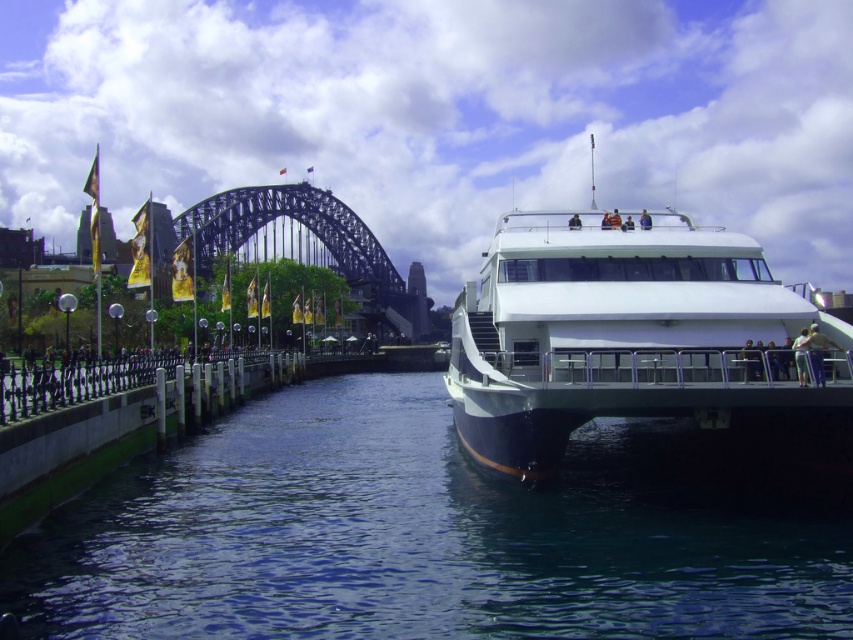
Can you confirm if blue water at center is shorter than white glossy cruise ship at center?

Indeed, blue water at center has a lesser height compared to white glossy cruise ship at center.

Is blue water at center to the left of white glossy cruise ship at center from the viewer's perspective?

Correct, you'll find blue water at center to the left of white glossy cruise ship at center.

Which is in front, point (270, 451) or point (558, 458)?

Point (558, 458) is more forward.

The image size is (853, 640). I want to click on blue water at center, so click(433, 532).

Between blue water at center and metallic steel bridge at upper center, which one has more height?

metallic steel bridge at upper center is taller.

Is blue water at center closer to the viewer compared to metallic steel bridge at upper center?

That is True.

Between point (786, 621) and point (415, 273), which one is positioned behind?

Point (415, 273)

This screenshot has width=853, height=640. Find the location of `blue water at center`. blue water at center is located at coordinates (433, 532).

Can you confirm if white glossy cruise ship at center is wider than metallic steel bridge at upper center?

Indeed, white glossy cruise ship at center has a greater width compared to metallic steel bridge at upper center.

Is white glossy cruise ship at center to the left of metallic steel bridge at upper center from the viewer's perspective?

Incorrect, white glossy cruise ship at center is not on the left side of metallic steel bridge at upper center.

Measure the distance between point (496, 436) and camera.

Point (496, 436) and camera are 78.41 meters apart from each other.

Where is `white glossy cruise ship at center`? white glossy cruise ship at center is located at coordinates (639, 342).